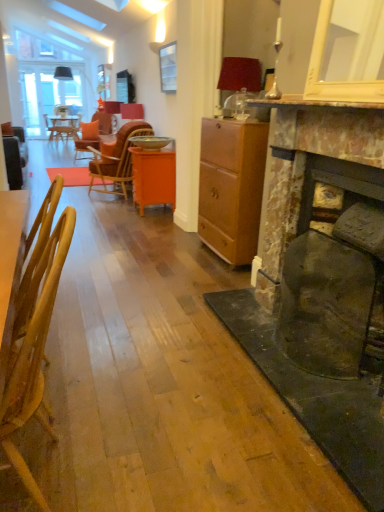
Question: Would you say metallic gold bowl at center is outside matte brown cabinet at center?

Choices:
 (A) no
 (B) yes

Answer: (B)

Question: Considering the relative sizes of metallic gold bowl at center and matte brown cabinet at center in the image provided, is metallic gold bowl at center smaller than matte brown cabinet at center?

Choices:
 (A) yes
 (B) no

Answer: (A)

Question: From the image's perspective, is metallic gold bowl at center located beneath matte brown cabinet at center?

Choices:
 (A) no
 (B) yes

Answer: (A)

Question: Does metallic gold bowl at center have a larger size compared to matte brown cabinet at center?

Choices:
 (A) yes
 (B) no

Answer: (B)

Question: Does metallic gold bowl at center have a lesser width compared to matte brown cabinet at center?

Choices:
 (A) yes
 (B) no

Answer: (B)

Question: From a real-world perspective, is orange wood chair at center, the second chair in the bottom-to-top sequence, physically located above or below matte red lampshade at upper right, which is counted as the first lamp, starting from the right?

Choices:
 (A) above
 (B) below

Answer: (B)

Question: Considering their positions, is orange wood chair at center, the 2th chair viewed from the front, located in front of or behind matte red lampshade at upper right, the 1th lamp when ordered from bottom to top?

Choices:
 (A) front
 (B) behind

Answer: (B)

Question: Choose the correct answer: Is orange wood chair at center, the 2th chair viewed from the front, inside matte red lampshade at upper right, the first lamp positioned from the front, or outside it?

Choices:
 (A) inside
 (B) outside

Answer: (B)

Question: Would you say orange wood chair at center, marked as the first chair in a top-to-bottom arrangement, is to the left or to the right of matte red lampshade at upper right, the 1th lamp when ordered from bottom to top, in the picture?

Choices:
 (A) left
 (B) right

Answer: (A)

Question: Is orange glossy cabinet at center taller or shorter than matte red lampshade at upper right, marked as the second lamp in a back-to-front arrangement?

Choices:
 (A) short
 (B) tall

Answer: (B)

Question: From a real-world perspective, is orange glossy cabinet at center above or below matte red lampshade at upper right, arranged as the second lamp when viewed from the left?

Choices:
 (A) above
 (B) below

Answer: (B)

Question: Considering the relative positions of orange glossy cabinet at center and matte red lampshade at upper right, the 1th lamp when ordered from bottom to top, in the image provided, is orange glossy cabinet at center to the left or to the right of matte red lampshade at upper right, the 1th lamp when ordered from bottom to top,?

Choices:
 (A) right
 (B) left

Answer: (B)

Question: Is orange glossy cabinet at center in front of or behind matte red lampshade at upper right, the 1th lamp when ordered from bottom to top, in the image?

Choices:
 (A) behind
 (B) front

Answer: (A)

Question: Visually, is metallic gold bowl at center positioned to the left or to the right of wooden chair at left, which is the first chair in bottom-to-top order?

Choices:
 (A) left
 (B) right

Answer: (B)

Question: Relative to wooden chair at left, the first chair when ordered from front to back, is metallic gold bowl at center in front or behind?

Choices:
 (A) behind
 (B) front

Answer: (A)